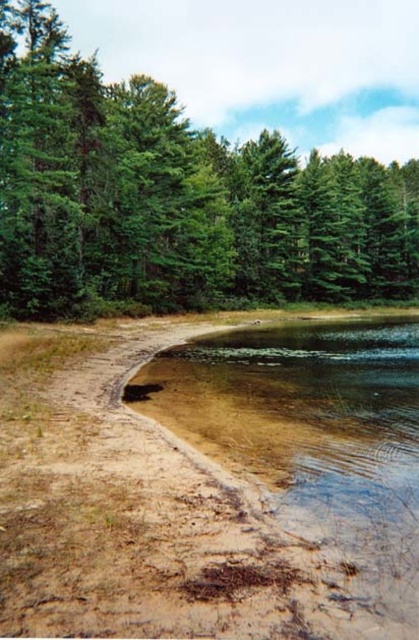
Is green leafy tree at upper left shorter than clear sedimentary sand at lower left?

In fact, green leafy tree at upper left may be taller than clear sedimentary sand at lower left.

Measure the distance from green leafy tree at upper left to clear sedimentary sand at lower left.

green leafy tree at upper left and clear sedimentary sand at lower left are 34.64 meters apart.

What do you see at coordinates (173, 198) in the screenshot? Image resolution: width=419 pixels, height=640 pixels. I see `green leafy tree at upper left` at bounding box center [173, 198].

The image size is (419, 640). I want to click on green leafy tree at upper left, so click(173, 198).